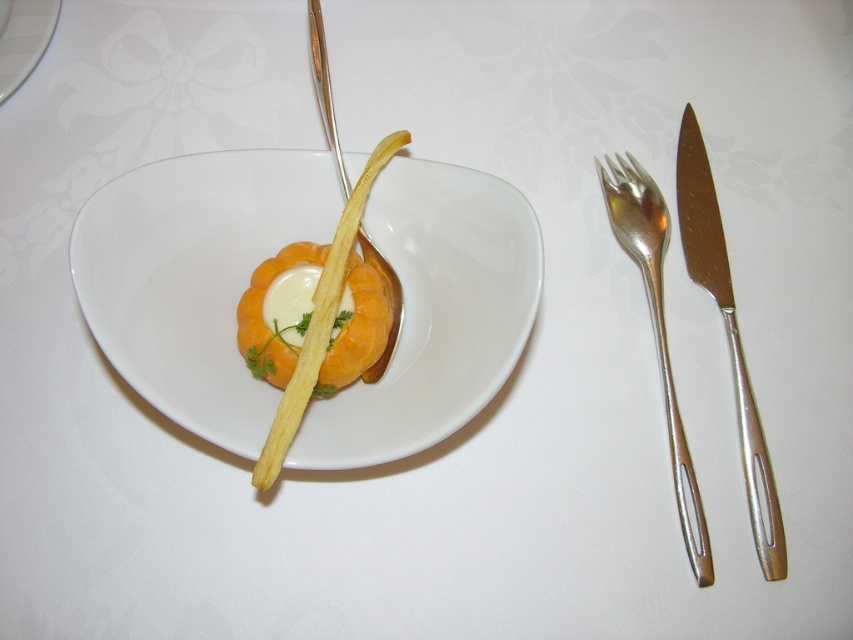
Question: Which object appears farthest from the camera in this image?

Choices:
 (A) white glossy bowl at center
 (B) polished silver knife at right
 (C) silver metallic fork at right

Answer: (B)

Question: Is yellow matte/pasta at center smaller than white glossy plate at upper left?

Choices:
 (A) yes
 (B) no

Answer: (B)

Question: Which point is closer to the camera?

Choices:
 (A) tap(219, 250)
 (B) tap(281, 330)
 (C) tap(691, 252)
 (D) tap(660, 220)

Answer: (B)

Question: Observing the image, what is the correct spatial positioning of white glossy bowl at center in reference to white glossy plate at upper left?

Choices:
 (A) below
 (B) above

Answer: (A)

Question: Does yellow matte/pasta at center appear over polished silver knife at right?

Choices:
 (A) no
 (B) yes

Answer: (B)

Question: Considering the real-world distances, which object is closest to the silver metallic fork at right?

Choices:
 (A) yellow matte/pasta at center
 (B) white glossy plate at upper left

Answer: (A)